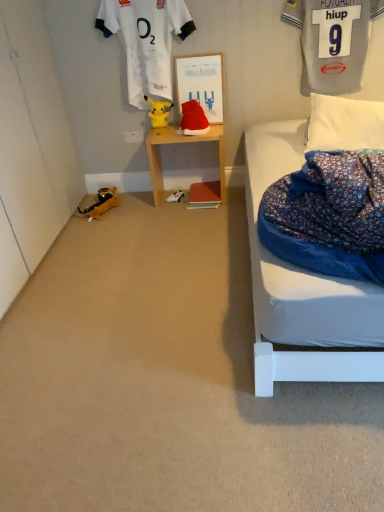
The image size is (384, 512). In order to click on vacant region in front of yellow plush toy at center, positioned as the 2th toy in right-to-left order in this screenshot , I will do `click(168, 129)`.